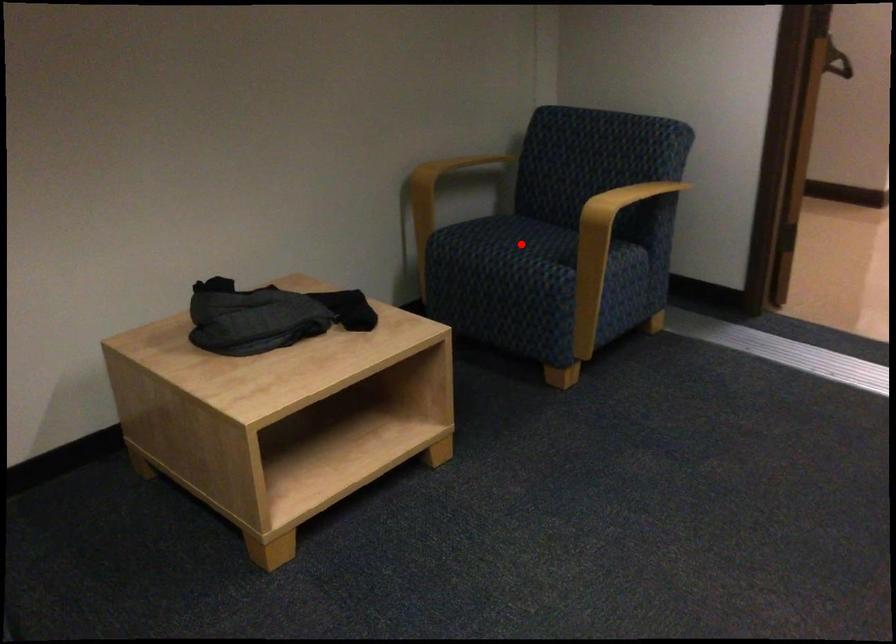
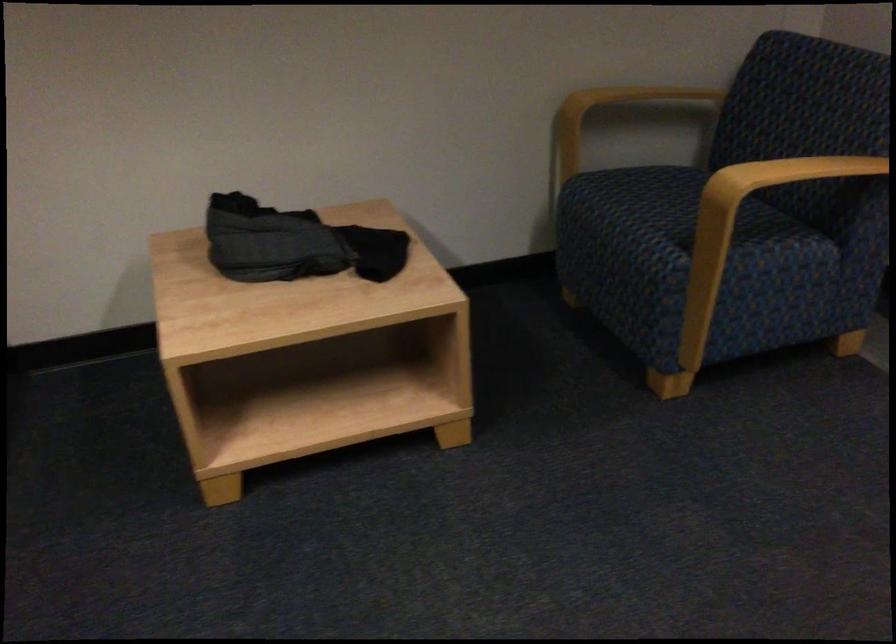
The point at the highlighted location is marked in the first image. Where is the corresponding point in the second image?

(659, 209)